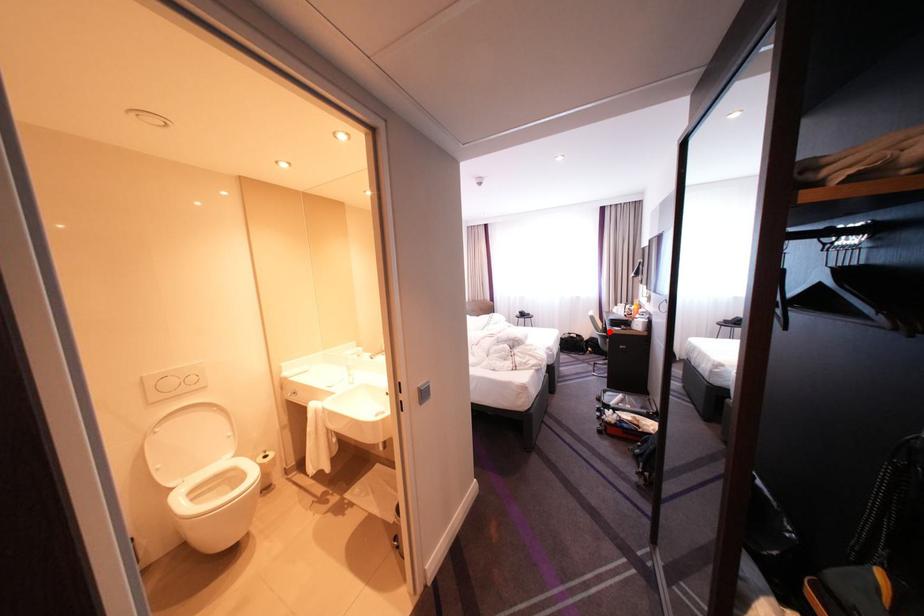
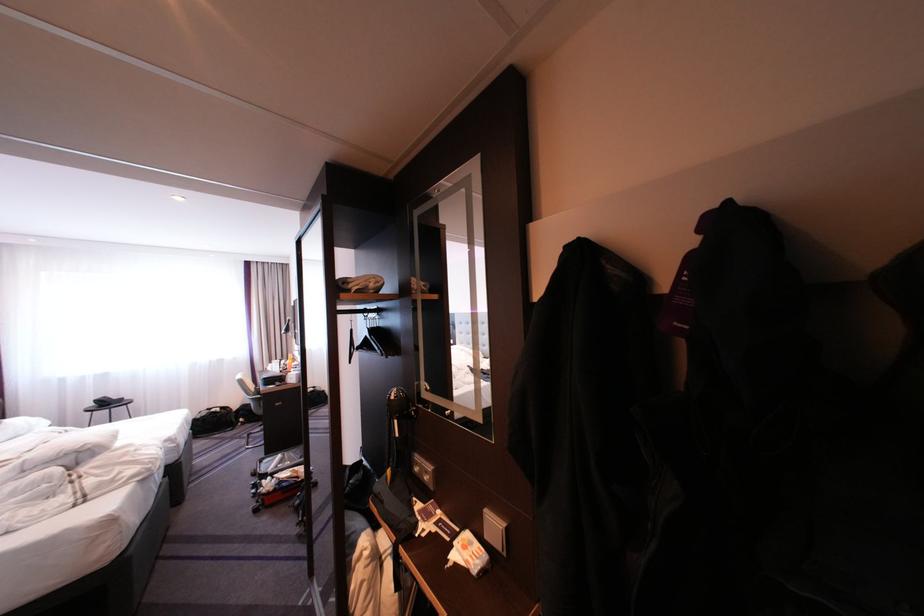
The point at the highlighted location is marked in the first image. Where is the corresponding point in the second image?

(261, 395)